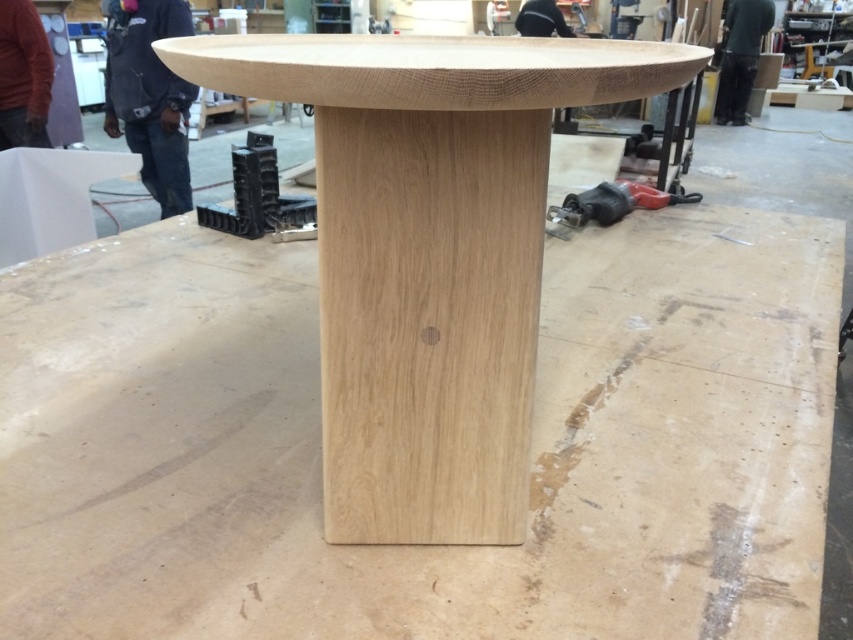
You are a carpenter who needs to place a red plastic drill at lower right on the natural wood table at center. Can you do that without the drill falling off?

The natural wood table at center is taller than red plastic drill at lower right, so yes, the red plastic drill at lower right can be placed on the natural wood table at center without falling off since the table is higher than the drill.

You are organizing a workshop and need to place a protective cover over the natural wood table at center and the red plastic drill at lower right. If the cover is only large enough to fit one item, which item should you prioritize covering based on their sizes?

The natural wood table at center is larger in size than the red plastic drill at lower right, so you should prioritize covering the natural wood table at center first.